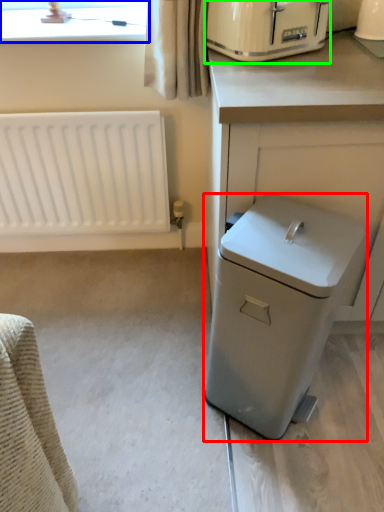
Question: Which object is positioned farthest from dish washer (highlighted by a red box)? Select from bay window (highlighted by a blue box) and home appliance (highlighted by a green box).

Choices:
 (A) bay window
 (B) home appliance

Answer: (A)